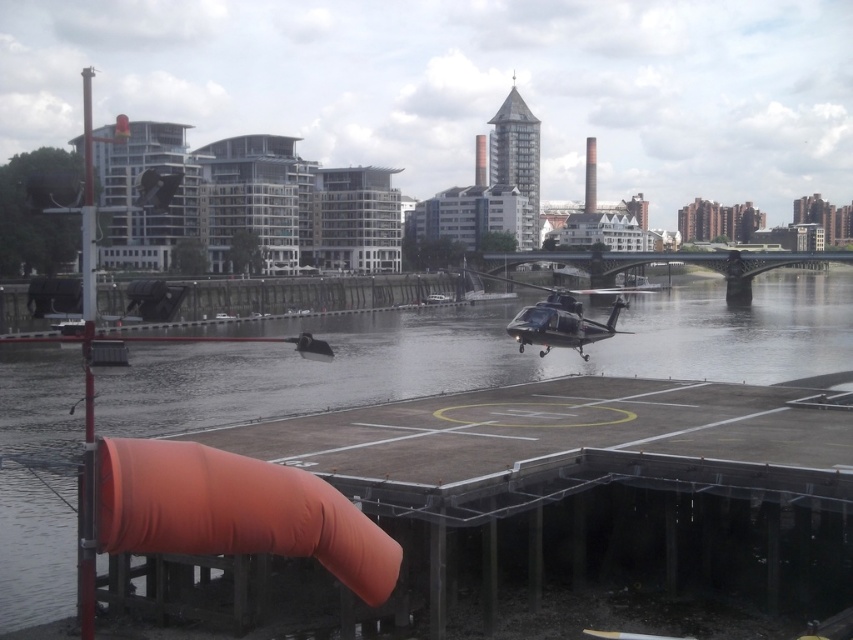
You are a pilot trying to land your helicopter on the helipad. You notice the transparent water at center and the metallic silver helicopter at center. Which object is positioned higher in the image?

The transparent water at center is above the metallic silver helicopter at center, so the transparent water at center is positioned higher in the image.

You are a pilot preparing to land your metallic silver helicopter at center on the helipad. You notice the transparent water at center nearby. Based on their sizes, which one occupies more space in the scene?

The transparent water at center has a larger size compared to the metallic silver helicopter at center, so the transparent water at center occupies more space in the scene.

You are a pilot preparing to land the metallic silver helicopter at center on the helipad. The helipad has a maximum width of 15 meters. Can you safely land the helicopter on the transparent water at center without exceeding the helipad limits?

The transparent water at center has a larger width than the metallic silver helicopter at center. Since the helipad is 15 meters wide and the water area is wider than the helicopter, there should be sufficient space for the helicopter to land safely within the designated area.